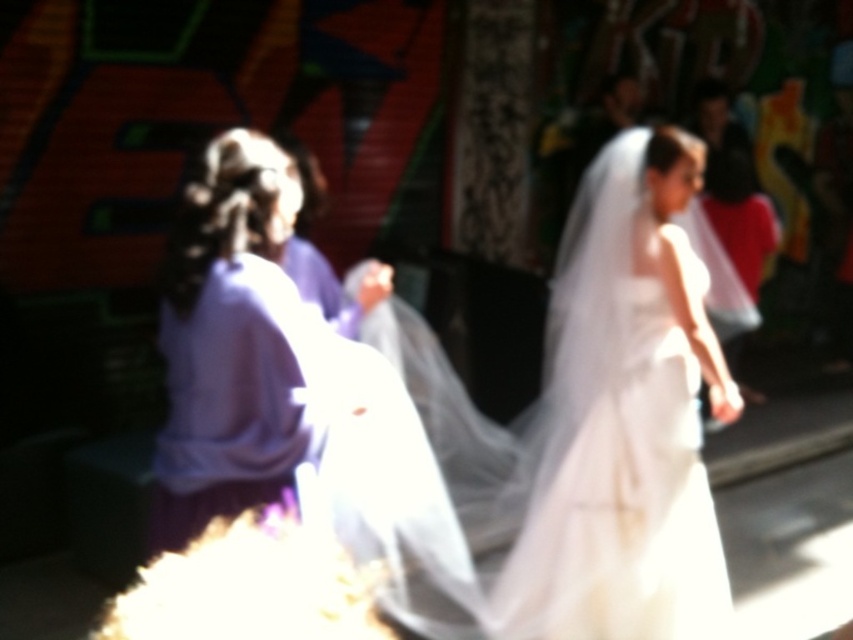
Question: Is white sheer dress at center to the right of purple satin dress at left from the viewer's perspective?

Choices:
 (A) no
 (B) yes

Answer: (B)

Question: Which of the following is the closest to the observer?

Choices:
 (A) white sheer dress at center
 (B) purple satin dress at left

Answer: (B)

Question: Is white sheer dress at center to the right of purple satin dress at left from the viewer's perspective?

Choices:
 (A) yes
 (B) no

Answer: (A)

Question: Is white sheer dress at center below purple satin dress at left?

Choices:
 (A) yes
 (B) no

Answer: (A)